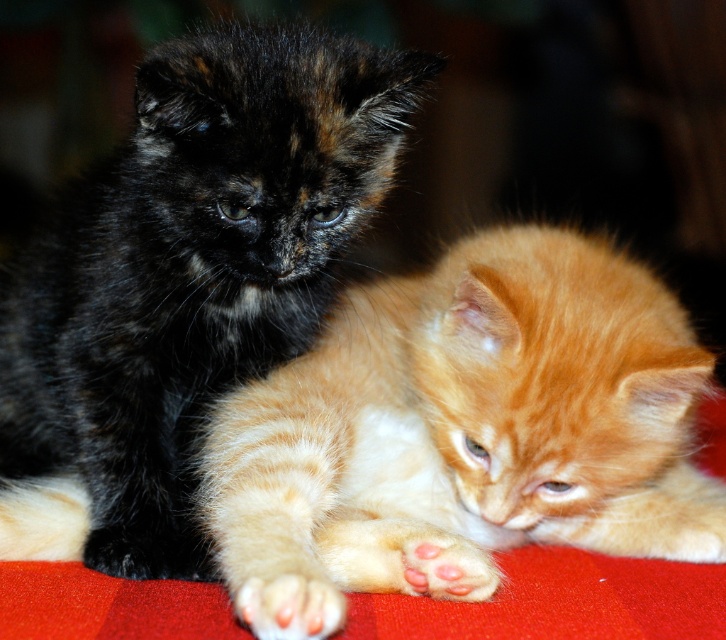
Which is more to the left, orange tabby kitten at center or black fur kitten at left?

black fur kitten at left

What do you see at coordinates (470, 426) in the screenshot? I see `orange tabby kitten at center` at bounding box center [470, 426].

Between point (388, 352) and point (136, 104), which one is positioned in front?

Point (136, 104)

Locate an element on the screen. The height and width of the screenshot is (640, 726). orange tabby kitten at center is located at coordinates (470, 426).

Can you confirm if black fur kitten at left is positioned to the right of white soft fur paw at lower left?

In fact, black fur kitten at left is to the left of white soft fur paw at lower left.

Is point (309, 42) closer to camera compared to point (319, 604)?

No, it is behind (319, 604).

Is point (183, 99) closer to viewer compared to point (266, 593)?

No, (183, 99) is further to viewer.

Locate an element on the screen. Image resolution: width=726 pixels, height=640 pixels. black fur kitten at left is located at coordinates (189, 269).

At what (x,y) coordinates should I click in order to perform the action: click on orange tabby kitten at center. Please return your answer as a coordinate pair (x, y). This screenshot has width=726, height=640. Looking at the image, I should click on (470, 426).

Does point (407, 358) lie behind point (272, 584)?

Yes, it is behind point (272, 584).

The height and width of the screenshot is (640, 726). Identify the location of orange tabby kitten at center. (470, 426).